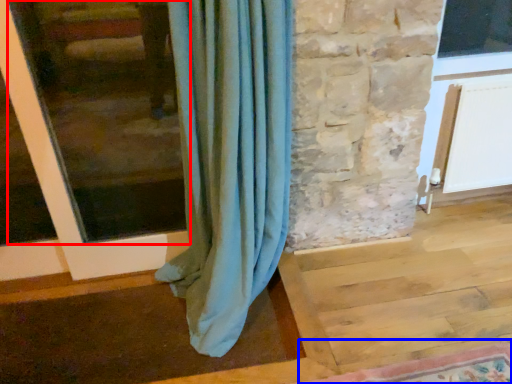
Question: Among these objects, which one is farthest to the camera, window frame (highlighted by a red box) or mat (highlighted by a blue box)?

Choices:
 (A) window frame
 (B) mat

Answer: (A)